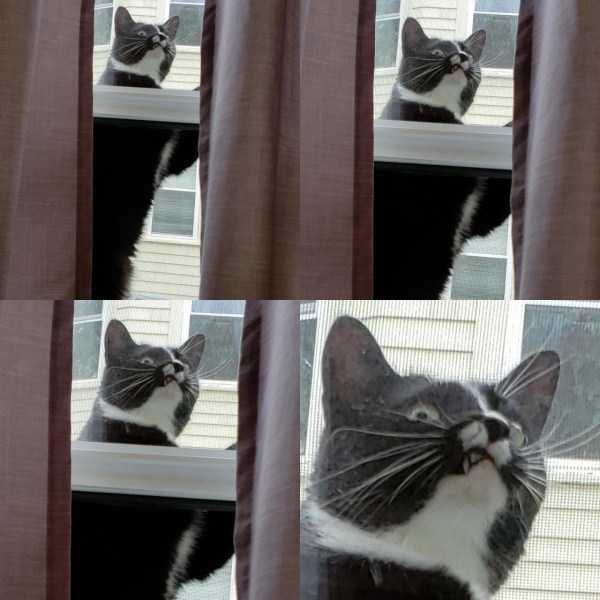
This screenshot has width=600, height=600. Identify the location of curtains. (17, 193), (253, 171), (318, 159), (541, 167), (1, 449), (284, 479).